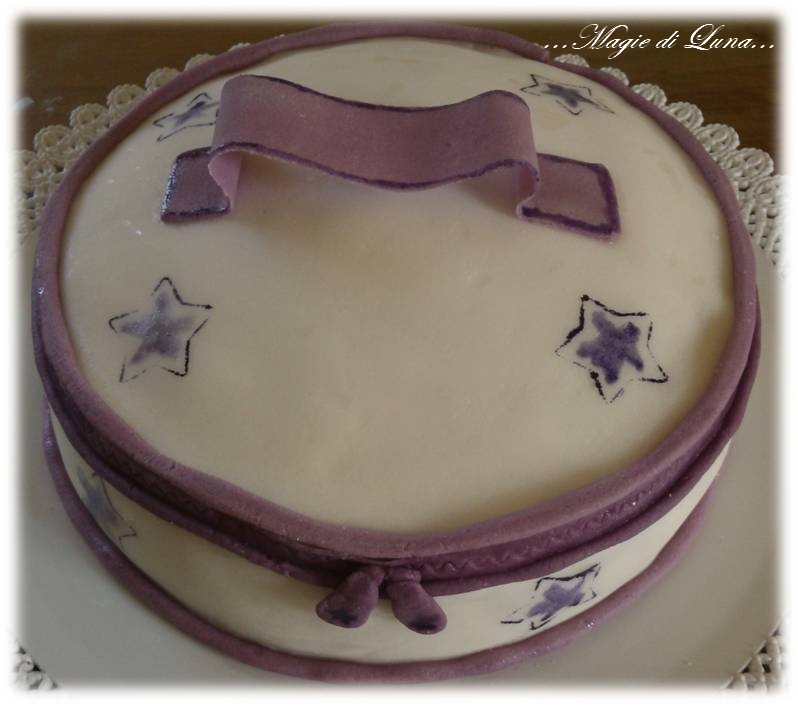
The image size is (798, 706). Identify the location of wood table. (723, 88).